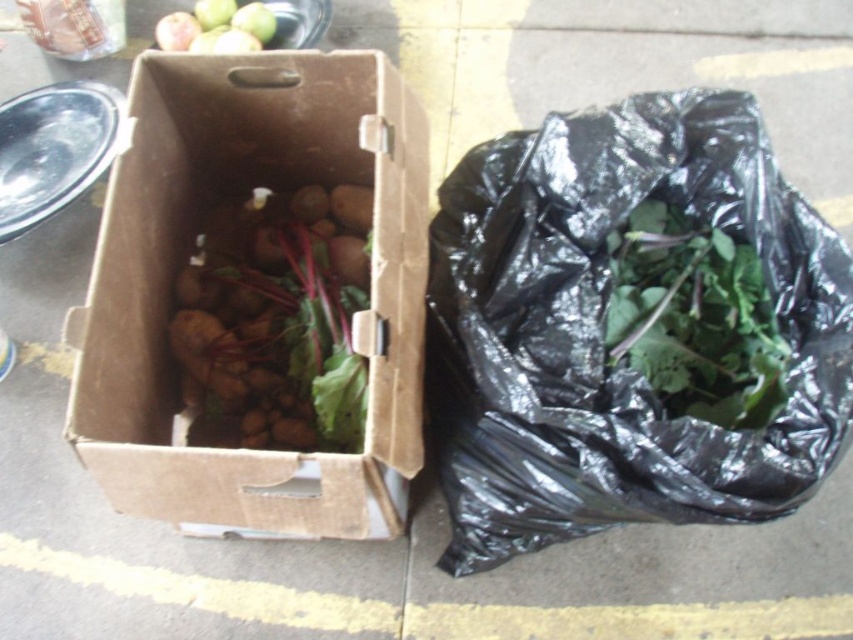
Does black plastic bag at right have a greater width compared to green leafy at right?

Correct, the width of black plastic bag at right exceeds that of green leafy at right.

Who is positioned more to the left, black plastic bag at right or green leafy at right?

black plastic bag at right

Is point (509, 506) positioned in front of point (749, 412)?

No, (509, 506) is behind (749, 412).

I want to click on black plastic bag at right, so click(602, 330).

Does brown cardboard box at center appear under green leafy at right?

No.

Who is more distant from viewer, (352, 531) or (630, 323)?

The point (630, 323) is more distant.

Between point (294, 115) and point (717, 273), which one is positioned behind?

The point (294, 115) is behind.

Where is `brown cardboard box at center`? This screenshot has height=640, width=853. brown cardboard box at center is located at coordinates (190, 250).

From the picture: Does black plastic bag at right appear over brown cardboard box at center?

No, black plastic bag at right is not above brown cardboard box at center.

The width and height of the screenshot is (853, 640). Describe the element at coordinates (602, 330) in the screenshot. I see `black plastic bag at right` at that location.

Does point (517, 211) lie in front of point (360, 77)?

That is True.

Locate an element on the screen. The width and height of the screenshot is (853, 640). black plastic bag at right is located at coordinates (602, 330).